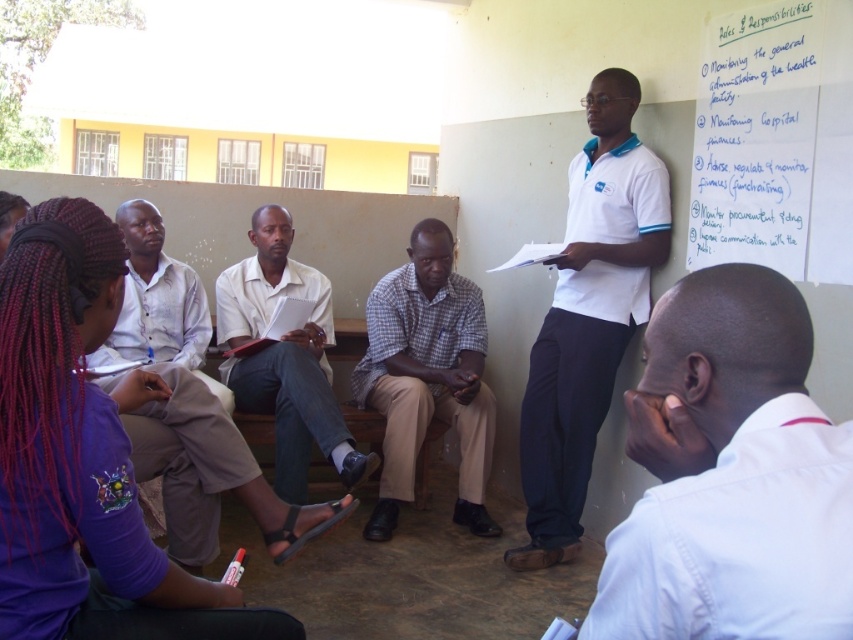
Question: Which of the following is the farthest from the observer?

Choices:
 (A) white shirt at upper right
 (B) white cotton shirt at upper right
 (C) light brown cotton shirt at center

Answer: (B)

Question: Among these points, which one is nearest to the camera?

Choices:
 (A) (715, 570)
 (B) (431, 275)
 (C) (572, 525)

Answer: (A)

Question: Does white shirt at upper right appear under light brown cotton shirt at center?

Choices:
 (A) no
 (B) yes

Answer: (B)

Question: Can you confirm if white cotton shirt at upper right is thinner than white shirt at center?

Choices:
 (A) yes
 (B) no

Answer: (A)

Question: Does white paper at upper right appear over white shirt at center?

Choices:
 (A) yes
 (B) no

Answer: (A)

Question: Estimate the real-world distances between objects in this image. Which object is farther from the plaid fabric shirt at center?

Choices:
 (A) white shirt at upper right
 (B) purple fabric shirt at lower left
 (C) white paper at upper right

Answer: (A)